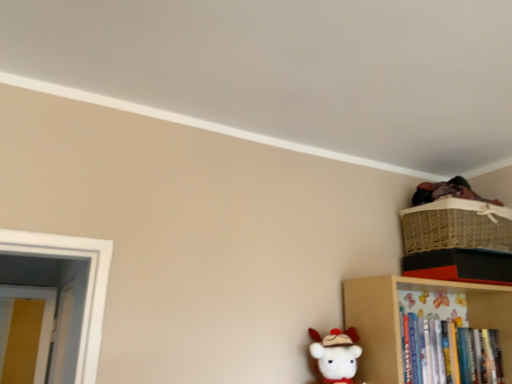
Question: From the image's perspective, is wooden bookshelf at lower right above woven straw basket at upper right?

Choices:
 (A) no
 (B) yes

Answer: (A)

Question: Would you say wooden bookshelf at lower right contains woven straw basket at upper right?

Choices:
 (A) yes
 (B) no

Answer: (B)

Question: Can you confirm if wooden bookshelf at lower right is positioned to the right of woven straw basket at upper right?

Choices:
 (A) no
 (B) yes

Answer: (A)

Question: Is wooden bookshelf at lower right not near woven straw basket at upper right?

Choices:
 (A) no
 (B) yes

Answer: (A)

Question: Is woven straw basket at upper right at the back of wooden bookshelf at lower right?

Choices:
 (A) no
 (B) yes

Answer: (A)

Question: In the image, is wooden bookshelf at lower right positioned in front of or behind white plush toy at lower center?

Choices:
 (A) behind
 (B) front

Answer: (A)

Question: Is wooden bookshelf at lower right wider or thinner than white plush toy at lower center?

Choices:
 (A) thin
 (B) wide

Answer: (B)

Question: From the image's perspective, is wooden bookshelf at lower right positioned above or below white plush toy at lower center?

Choices:
 (A) below
 (B) above

Answer: (A)

Question: Is wooden bookshelf at lower right inside the boundaries of white plush toy at lower center, or outside?

Choices:
 (A) inside
 (B) outside

Answer: (B)

Question: Is point (510, 322) closer or farther from the camera than point (479, 238)?

Choices:
 (A) closer
 (B) farther

Answer: (B)

Question: Considering their positions, is wooden bookshelf at lower right located in front of or behind woven straw basket at upper right?

Choices:
 (A) behind
 (B) front

Answer: (B)

Question: Choose the correct answer: Is wooden bookshelf at lower right inside woven straw basket at upper right or outside it?

Choices:
 (A) outside
 (B) inside

Answer: (A)

Question: Is wooden bookshelf at lower right to the left or to the right of woven straw basket at upper right in the image?

Choices:
 (A) right
 (B) left

Answer: (B)

Question: Relative to white plush toy at lower center, is woven straw basket at upper right in front or behind?

Choices:
 (A) front
 (B) behind

Answer: (B)

Question: Is woven straw basket at upper right bigger or smaller than white plush toy at lower center?

Choices:
 (A) small
 (B) big

Answer: (B)